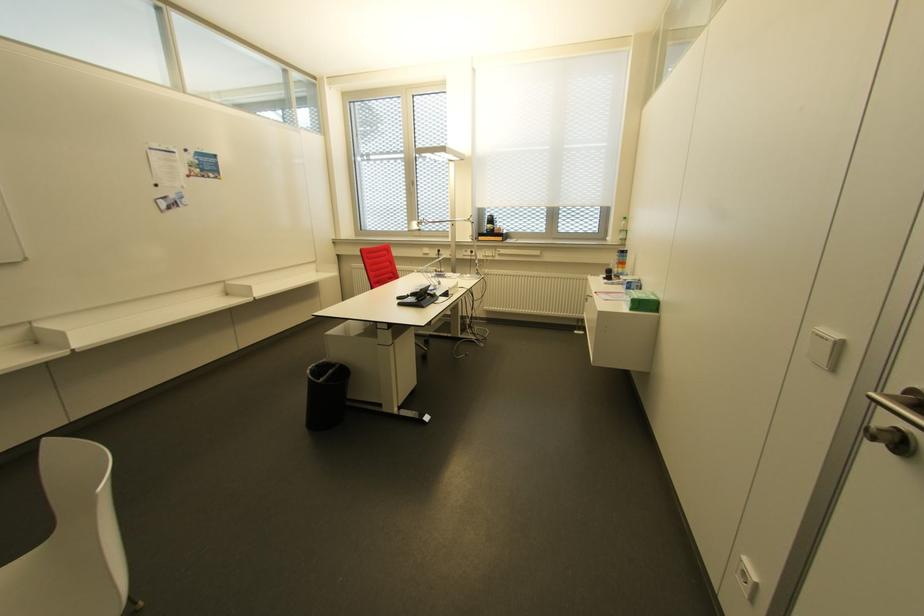
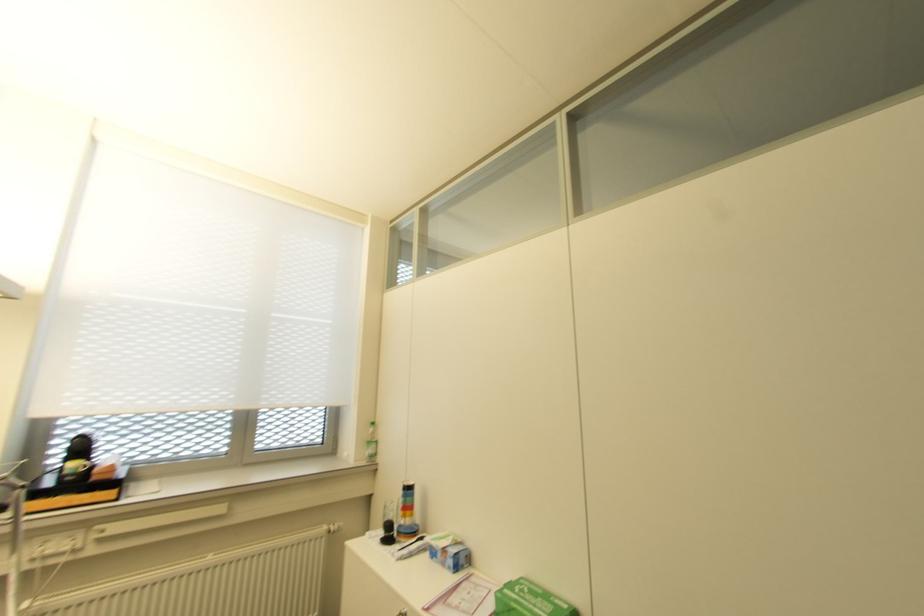
In the second image, find the point that corresponds to [623,240] in the first image.

(372, 455)